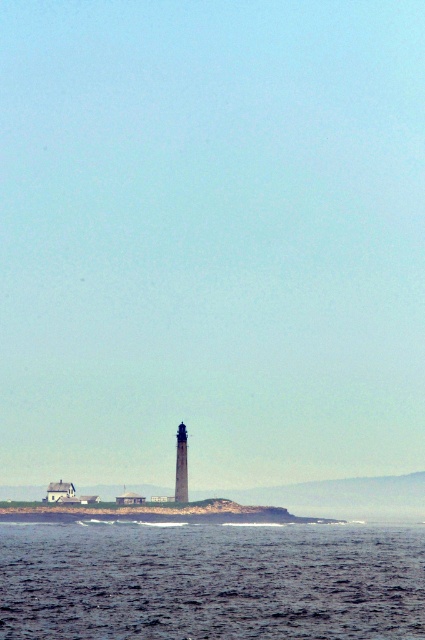
Is point (47, 528) closer to viewer compared to point (184, 488)?

That is False.

How distant is dark blue water at lower center from smooth gray tower at center?

dark blue water at lower center and smooth gray tower at center are 320.21 feet apart.

Locate an element on the screen. This screenshot has height=640, width=425. dark blue water at lower center is located at coordinates (210, 580).

I want to click on dark blue water at lower center, so click(x=210, y=580).